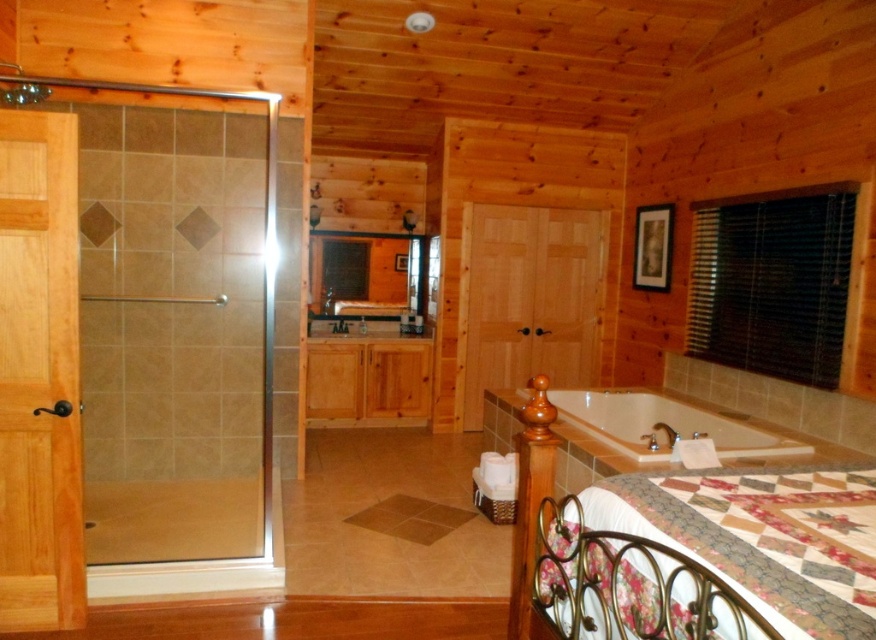
Question: Considering the real-world distances, which object is closest to the floral patchwork quilt at lower right?

Choices:
 (A) clear glass door at left
 (B) wooden cabinet at center
 (C) white glossy bathtub at lower right

Answer: (C)

Question: Considering the relative positions of clear glass door at left and wooden cabinet at center in the image provided, where is clear glass door at left located with respect to wooden cabinet at center?

Choices:
 (A) above
 (B) below

Answer: (B)

Question: Is floral patchwork quilt at lower right bigger than wooden cabinet at center?

Choices:
 (A) no
 (B) yes

Answer: (A)

Question: Considering the real-world distances, which object is farthest from the white glossy bathtub at lower right?

Choices:
 (A) wooden cabinet at center
 (B) floral patchwork quilt at lower right
 (C) clear glass door at left

Answer: (C)

Question: Which object is the closest to the clear glass door at left?

Choices:
 (A) wooden cabinet at center
 (B) white glossy bathtub at lower right

Answer: (B)

Question: Is clear glass door at left above wooden cabinet at center?

Choices:
 (A) yes
 (B) no

Answer: (B)